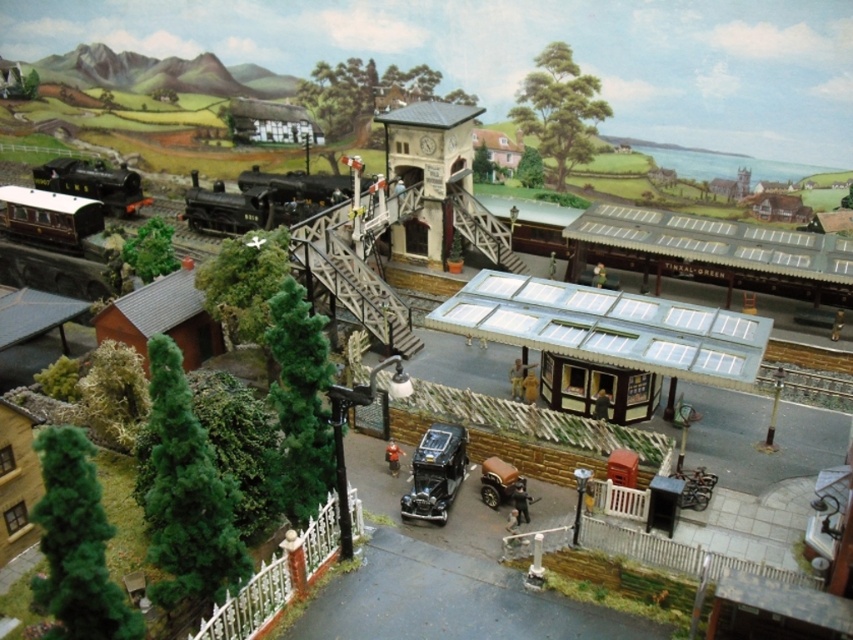
Question: Which point appears farthest from the camera in this image?

Choices:
 (A) (410, 497)
 (B) (221, 209)

Answer: (B)

Question: Is matte black train at left positioned behind shiny black car at center?

Choices:
 (A) no
 (B) yes

Answer: (B)

Question: Is the position of shiny black locomotive at left more distant than that of shiny brown car at center?

Choices:
 (A) no
 (B) yes

Answer: (B)

Question: Is shiny black car at center positioned behind shiny black locomotive at left?

Choices:
 (A) no
 (B) yes

Answer: (A)

Question: Estimate the real-world distances between objects in this image. Which object is farther from the shiny brown car at center?

Choices:
 (A) black polished wood train at center
 (B) shiny black locomotive at left
 (C) shiny black car at center

Answer: (B)

Question: Which point is farther from the camera taking this photo?

Choices:
 (A) (440, 515)
 (B) (341, 195)
 (C) (503, 477)

Answer: (B)